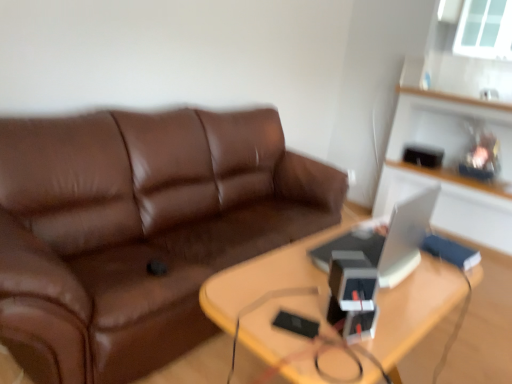
Consider the image. What is the approximate width of wooden table at center?

wooden table at center is 22.81 inches wide.

Measure the distance between point (322, 172) and camera.

2.70 meters.

Where is `white glossy computer at right`? Image resolution: width=512 pixels, height=384 pixels. white glossy computer at right is located at coordinates (387, 239).

The height and width of the screenshot is (384, 512). In order to click on wooden table at center in this screenshot , I will do `click(273, 295)`.

From a real-world perspective, is brown leather couch at center positioned above or below wooden table at center?

brown leather couch at center is situated higher than wooden table at center in the real world.

Who is bigger, brown leather couch at center or wooden table at center?

brown leather couch at center is bigger.

Considering the sizes of objects brown leather couch at center and wooden table at center in the image provided, who is thinner, brown leather couch at center or wooden table at center?

Thinner between the two is wooden table at center.

From the image's perspective, which object appears higher, brown leather couch at center or wooden table at center?

brown leather couch at center appears higher in the image.

Which is more distant, (291, 276) or (412, 266)?

The point (412, 266) is behind.

Is wooden table at center positioned with its back to white glossy computer at right?

That's not correct — wooden table at center is not looking away from white glossy computer at right.

Between wooden table at center and white glossy computer at right, which one has larger width?

wooden table at center is wider.

From a real-world perspective, is wooden table at center on white glossy computer at right?

Incorrect, from a real-world perspective, wooden table at center is lower than white glossy computer at right.

From a real-world perspective, does transparent glass window at upper right stand above brown leather couch at center?

Yes.

From the image's perspective, relative to brown leather couch at center, is transparent glass window at upper right above or below?

transparent glass window at upper right is situated higher than brown leather couch at center in the image.

Which object is closer to the camera taking this photo, transparent glass window at upper right or brown leather couch at center?

Positioned in front is brown leather couch at center.

Considering the sizes of objects wooden table at center and brown leather couch at center in the image provided, who is thinner, wooden table at center or brown leather couch at center?

wooden table at center is thinner.

Is wooden table at center oriented away from brown leather couch at center?

Yes.

Is the position of wooden table at center less distant than that of brown leather couch at center?

Yes, wooden table at center is closer to the viewer.

Would you say white glossy computer at right is part of brown leather couch at center's contents?

No, white glossy computer at right is not surrounded by brown leather couch at center.

Considering the positions of point (70, 149) and point (353, 234), is point (70, 149) closer or farther from the camera than point (353, 234)?

Point (70, 149) is positioned farther from the camera compared to point (353, 234).

Considering their positions, is brown leather couch at center located in front of or behind white glossy computer at right?

Visually, brown leather couch at center is located in front of white glossy computer at right.

From the image's perspective, is brown leather couch at center located above white glossy computer at right?

Indeed, from the image's perspective, brown leather couch at center is shown above white glossy computer at right.

At what (x,y) coordinates should I click in order to perform the action: click on window screen above the wooden table at center (from a real-world perspective). Please return your answer as a coordinate pair (x, y). Looking at the image, I should click on (485, 29).

Considering the relative sizes of wooden table at center and transparent glass window at upper right in the image provided, is wooden table at center wider than transparent glass window at upper right?

Yes.

What's the angular difference between wooden table at center and transparent glass window at upper right's facing directions?

They differ by 92.3 degrees in their facing directions.

From a real-world perspective, between wooden table at center and transparent glass window at upper right, who is vertically lower?

In real-world perspective, wooden table at center is lower.

Considering the sizes of objects white glossy computer at right and wooden table at center in the image provided, who is taller, white glossy computer at right or wooden table at center?

wooden table at center is taller.

At what (x,y) coordinates should I click in order to perform the action: click on table that appears in front of the white glossy computer at right. Please return your answer as a coordinate pair (x, y). The image size is (512, 384). Looking at the image, I should click on (273, 295).

Based on the photo, which point is more distant from viewer, (355, 228) or (316, 294)?

The point (355, 228) is farther from the camera.

Would you say white glossy computer at right is outside wooden table at center?

Yes.

Where is `table below the brown leather couch at center (from a real-world perspective)`? The image size is (512, 384). table below the brown leather couch at center (from a real-world perspective) is located at coordinates (273, 295).

Locate an element on the screen. This screenshot has height=384, width=512. table below the white glossy computer at right (from the image's perspective) is located at coordinates (273, 295).

When comparing their distances from transparent glass window at upper right, does brown leather couch at center or white glossy computer at right seem further?

Based on the image, white glossy computer at right appears to be further to transparent glass window at upper right.

Estimate the real-world distances between objects in this image. Which object is further from brown leather couch at center, white glossy computer at right or wooden table at center?

white glossy computer at right.

Looking at the image, which one is located closer to transparent glass window at upper right, white glossy computer at right or wooden table at center?

The object closer to transparent glass window at upper right is white glossy computer at right.

Which object lies further to the anchor point brown leather couch at center, wooden table at center or transparent glass window at upper right?

transparent glass window at upper right lies further to brown leather couch at center than the other object.

From the image, which object appears to be farther from transparent glass window at upper right, wooden table at center or brown leather couch at center?

wooden table at center is positioned further to the anchor transparent glass window at upper right.

Looking at the image, which one is located closer to white glossy computer at right, transparent glass window at upper right or brown leather couch at center?

brown leather couch at center.

Which object lies nearer to the anchor point transparent glass window at upper right, white glossy computer at right or brown leather couch at center?

brown leather couch at center lies closer to transparent glass window at upper right than the other object.

Estimate the real-world distances between objects in this image. Which object is closer to wooden table at center, transparent glass window at upper right or white glossy computer at right?

white glossy computer at right.

This screenshot has height=384, width=512. Identify the location of computer positioned between brown leather couch at center and transparent glass window at upper right from near to far. (387, 239).

In order to click on studio couch positioned between wooden table at center and transparent glass window at upper right from near to far in this screenshot , I will do 139,231.

Find the location of a particular element. Image resolution: width=512 pixels, height=384 pixels. computer between wooden table at center and transparent glass window at upper right along the z-axis is located at coordinates (387, 239).

The width and height of the screenshot is (512, 384). Identify the location of table situated between brown leather couch at center and white glossy computer at right from left to right. (273, 295).